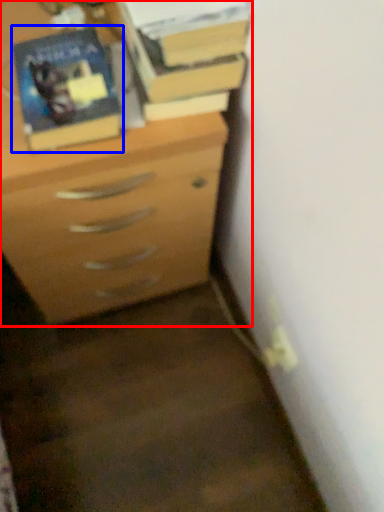
Question: Which object is closer to the camera taking this photo, chest of drawers (highlighted by a red box) or paperback book (highlighted by a blue box)?

Choices:
 (A) chest of drawers
 (B) paperback book

Answer: (B)